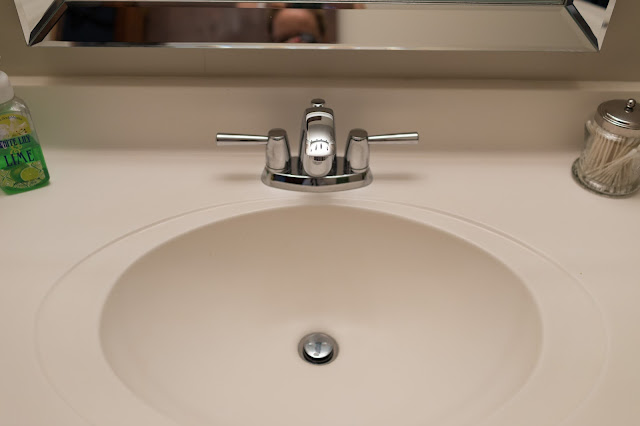
In order to click on plug in this screenshot , I will do `click(316, 351)`.